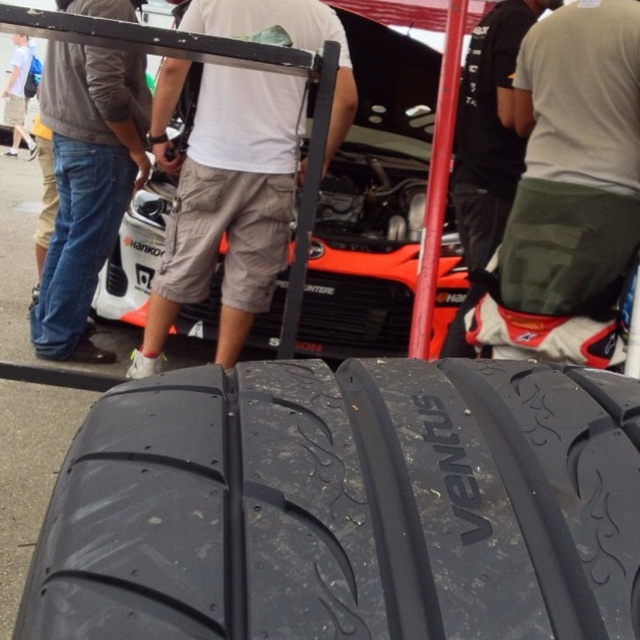
Question: Based on their relative distances, which object is farther from the white cotton shirt at upper center?

Choices:
 (A) denim jeans at left
 (B) dark gray shorts at center
 (C) black rubber tire at lower center
 (D) matte khaki shorts at center

Answer: (C)

Question: Which point is closer to the camera?

Choices:
 (A) (10, 115)
 (B) (108, 204)
 (C) (480, 176)
 (D) (612, 228)

Answer: (D)

Question: Where is matte khaki shorts at center located in relation to white cotton shirt at upper center in the image?

Choices:
 (A) left
 (B) right

Answer: (B)

Question: Observing the image, what is the correct spatial positioning of green camo shorts at center in reference to white cotton shirt at upper center?

Choices:
 (A) below
 (B) above

Answer: (A)

Question: Which of the following is the farthest from the observer?

Choices:
 (A) denim jeans at left
 (B) matte khaki shorts at center
 (C) white cotton shirt at upper center

Answer: (C)

Question: Does black rubber tire at lower center appear over matte khaki shorts at center?

Choices:
 (A) yes
 (B) no

Answer: (B)